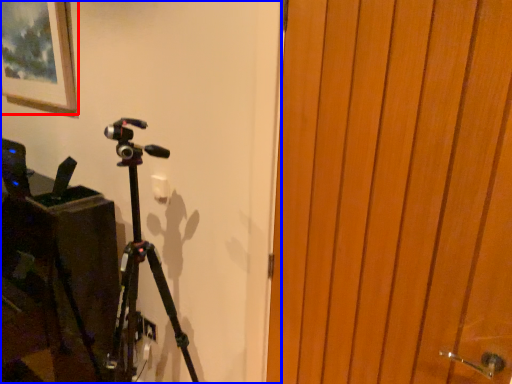
Question: Which point is further to the camera, picture frame (highlighted by a red box) or backdrop (highlighted by a blue box)?

Choices:
 (A) picture frame
 (B) backdrop

Answer: (A)